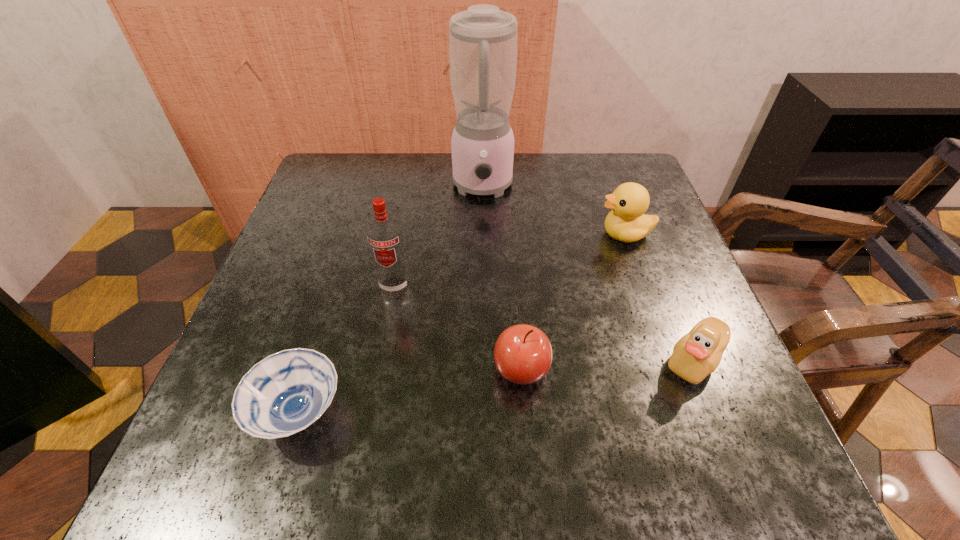
At what (x,y) coordinates should I click in order to perform the action: click on free space at the near right corner of the desktop. Please return your answer as a coordinate pair (x, y). Looking at the image, I should click on (720, 474).

This screenshot has width=960, height=540. Find the location of `free space between the farthest object and the apple`. free space between the farthest object and the apple is located at coordinates (502, 278).

Where is `vacant point located between the farther duck and the apple`? vacant point located between the farther duck and the apple is located at coordinates (573, 301).

You are a GUI agent. You are given a task and a screenshot of the screen. Output one action in this format:
    pyautogui.click(x=<x>, y=<y>)
    Task: Click on the vacant point located between the leftmost object and the third farthest object
    The width and height of the screenshot is (960, 540).
    Given the screenshot: What is the action you would take?
    pyautogui.click(x=347, y=349)

At what (x,y) coordinates should I click in order to perform the action: click on empty space between the shortest object and the farthest object. Please return your answer as a coordinate pair (x, y). This screenshot has height=540, width=960. Looking at the image, I should click on (391, 300).

At what (x,y) coordinates should I click in order to perform the action: click on vacant area between the apple and the tallest object. Please return your answer as a coordinate pair (x, y). Looking at the image, I should click on (502, 278).

Identify the location of vacant area between the shorter duck and the apple. (608, 364).

Identify the location of blank region between the third farthest object and the nearer duck. This screenshot has width=960, height=540. (544, 323).

You are a GUI agent. You are given a task and a screenshot of the screen. Output one action in this format:
    pyautogui.click(x=<x>, y=<y>)
    Task: Click on the free space between the vodka and the farthest object
    This screenshot has height=540, width=960.
    Given the screenshot: What is the action you would take?
    pyautogui.click(x=439, y=237)

Locate an element on the screen. This screenshot has height=540, width=960. vacant area between the shorter duck and the fifth nearest object is located at coordinates (660, 297).